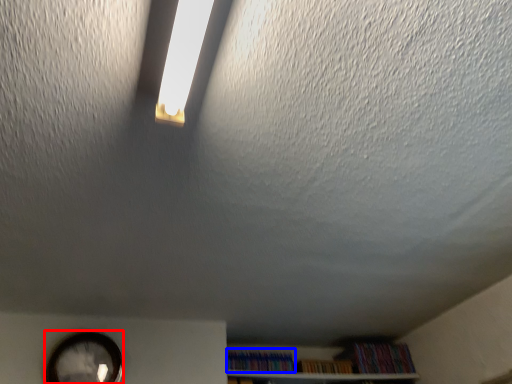
Question: Which of the following is the closest to the observer, clock (highlighted by a red box) or book (highlighted by a blue box)?

Choices:
 (A) clock
 (B) book

Answer: (A)